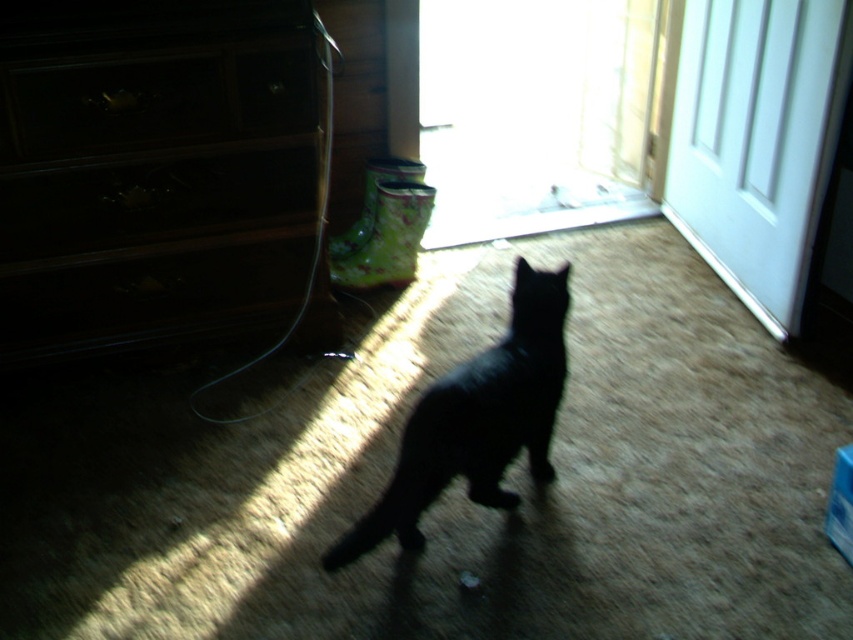
From the picture: You are a delivery person entering the room and need to place a large package on the floor. The package is too heavy to lift, so you must push it from the center of the room towards the white glossy door at upper right. Considering the dark wood dresser at left is in the way, will you be able to maneuver around it to reach the door?

The dark wood dresser at left has a larger size compared to white glossy door at upper right. Since the dark wood dresser at left is larger, it may block the direct path towards the white glossy door at upper right. However, you can maneuver around it by moving to the right side of the dresser, as the dresser is on the left, allowing you to navigate towards the door on the upper right.